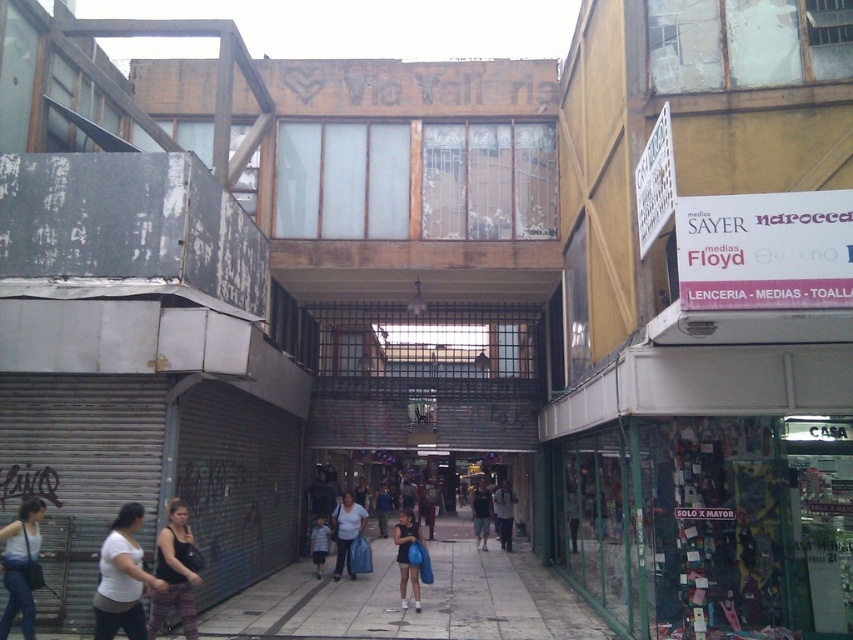
Who is shorter, white matte shirt at lower left or white tank top at lower left?

white matte shirt at lower left is shorter.

What are the coordinates of `white matte shirt at lower left` in the screenshot? It's located at (122, 579).

Is point (96, 595) in front of point (15, 557)?

Yes, it is in front of point (15, 557).

Where is `white matte shirt at lower left`? The image size is (853, 640). white matte shirt at lower left is located at coordinates tap(122, 579).

Who is taller, matte blue bag at center or white tank top at lower left?

Standing taller between the two is matte blue bag at center.

Is matte blue bag at center above white tank top at lower left?

No, matte blue bag at center is not above white tank top at lower left.

The height and width of the screenshot is (640, 853). Find the location of `matte blue bag at center`. matte blue bag at center is located at coordinates (410, 600).

Does blue fabric bag at center appear over light blue denim shorts at center?

Yes, blue fabric bag at center is above light blue denim shorts at center.

Who is positioned more to the left, blue fabric bag at center or light blue denim shorts at center?

From the viewer's perspective, light blue denim shorts at center appears more on the left side.

Is point (399, 582) closer to viewer compared to point (376, 488)?

Yes, it is.

Image resolution: width=853 pixels, height=640 pixels. What are the coordinates of `blue fabric bag at center` in the screenshot? It's located at (408, 556).